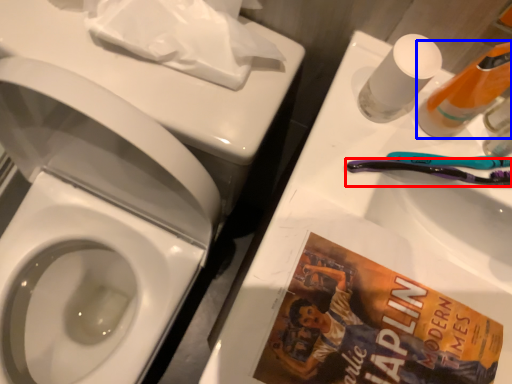
Question: Which point is further to the camera, toothbrush (highlighted by a red box) or cleaning product (highlighted by a blue box)?

Choices:
 (A) toothbrush
 (B) cleaning product

Answer: (A)